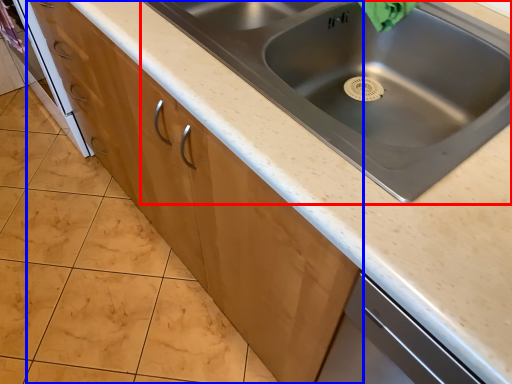
Question: Which object is further to the camera taking this photo, sink (highlighted by a red box) or cabinetry (highlighted by a blue box)?

Choices:
 (A) sink
 (B) cabinetry

Answer: (B)